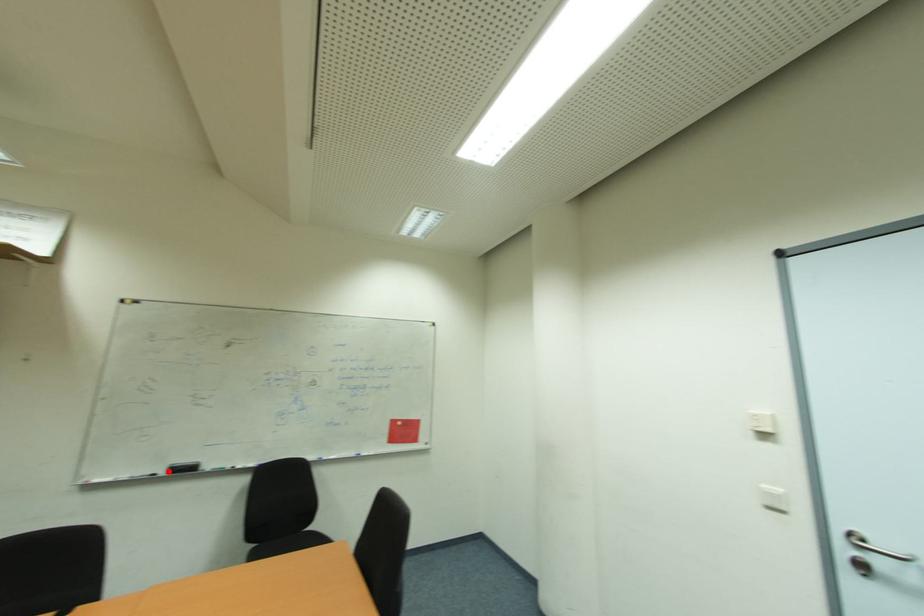
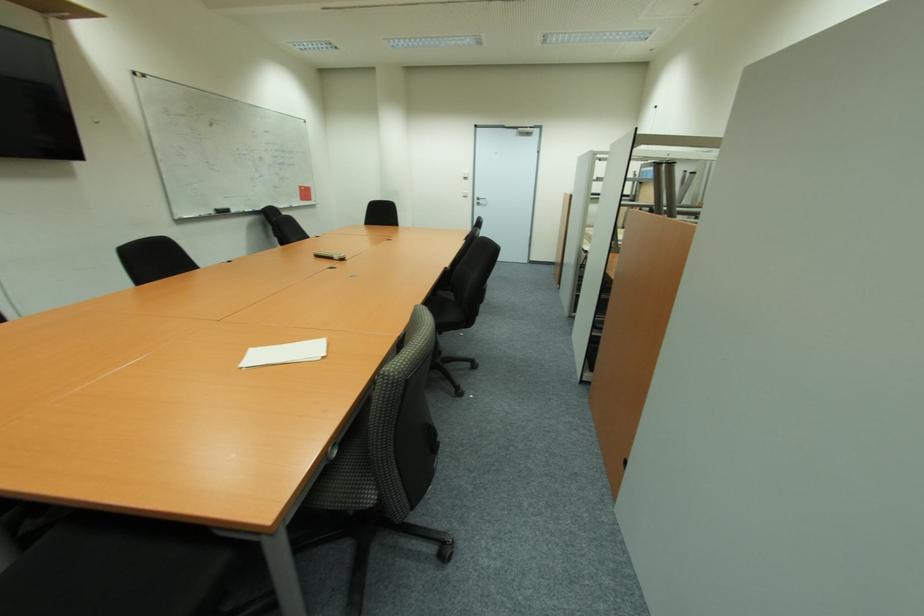
In the second image, find the point that corresponds to the highlighted location in the first image.

(215, 214)